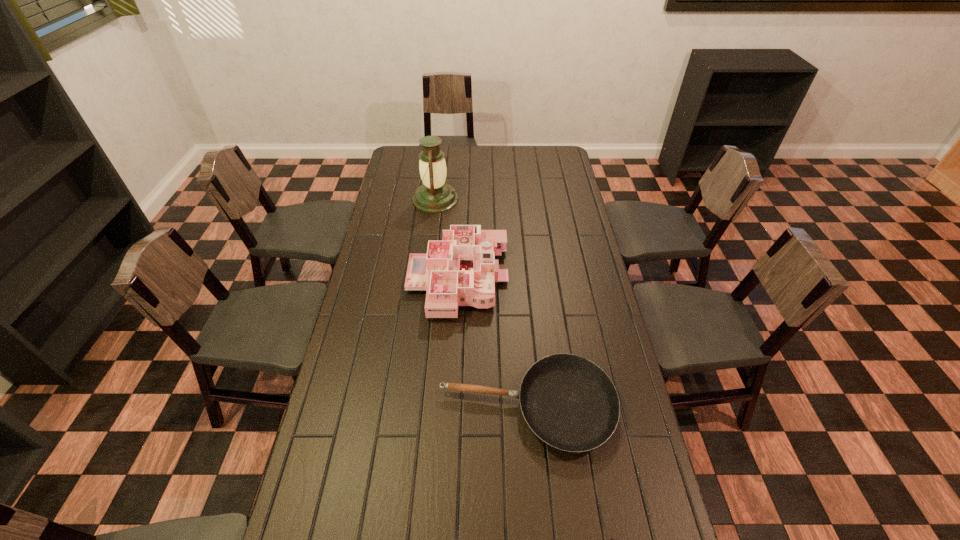
Find the location of a particular element. object that is at the right edge is located at coordinates (570, 403).

Where is `vacant area at the far edge`? vacant area at the far edge is located at coordinates (481, 164).

In the image, there is a desktop. Find the location of `free region at the left edge`. free region at the left edge is located at coordinates (340, 411).

In the image, there is a desktop. Where is `vacant area at the right edge`? This screenshot has height=540, width=960. vacant area at the right edge is located at coordinates (568, 186).

You are a GUI agent. You are given a task and a screenshot of the screen. Output one action in this format:
    pyautogui.click(x=<x>, y=<y>)
    Task: Click on the free spot at the far left corner of the desktop
    This screenshot has height=540, width=960.
    Given the screenshot: What is the action you would take?
    pyautogui.click(x=406, y=160)

Find the location of a particular element. vacant region at the far right corner of the desktop is located at coordinates (560, 157).

Locate an element on the screen. This screenshot has height=540, width=960. empty location between the second tallest object and the third tallest object is located at coordinates (492, 343).

Identify the location of object that is the third closest to the shortest object. This screenshot has height=540, width=960. (434, 195).

Find the location of a particular element. object that can be found as the closest to the third farthest object is located at coordinates (460, 270).

Locate an element on the screen. Image resolution: width=960 pixels, height=540 pixels. free spot that satisfies the following two spatial constraints: 1. on the back side of the frying pan; 2. with the light compartment facing forward on the lantern is located at coordinates (510, 199).